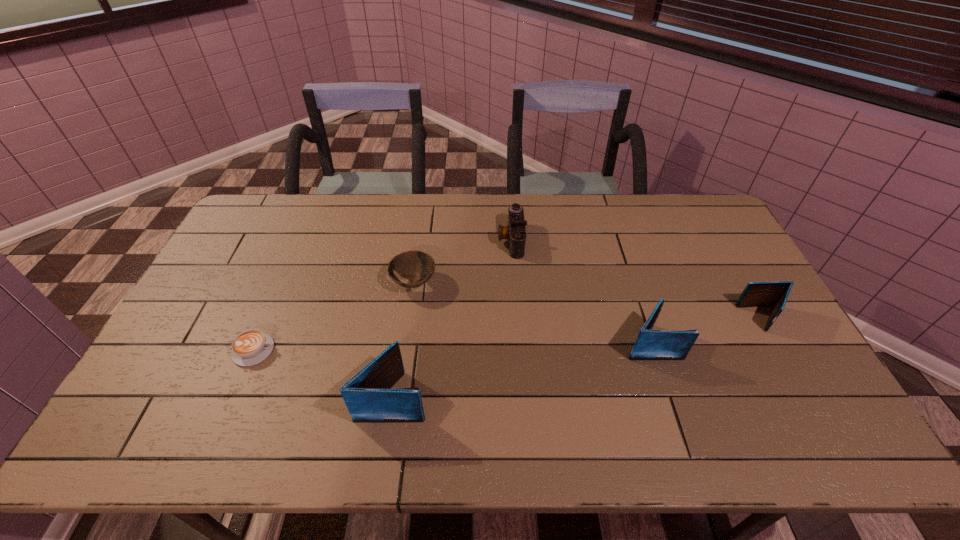
This screenshot has width=960, height=540. I want to click on object that ranks as the second closest to the second tallest object, so 515,232.

Select which object is the fourth closest to the shortest object. Please provide its 2D coordinates. Your answer should be formatted as a tuple, i.e. [(x, y)], where the tuple contains the x and y coordinates of a point satisfying the conditions above.

[(650, 344)]

Select which wallet is the second closest to the rightmost object. Please provide its 2D coordinates. Your answer should be formatted as a tuple, i.e. [(x, y)], where the tuple contains the x and y coordinates of a point satisfying the conditions above.

[(368, 396)]

The height and width of the screenshot is (540, 960). I want to click on wallet that is the second closest to the second shortest object, so click(x=650, y=344).